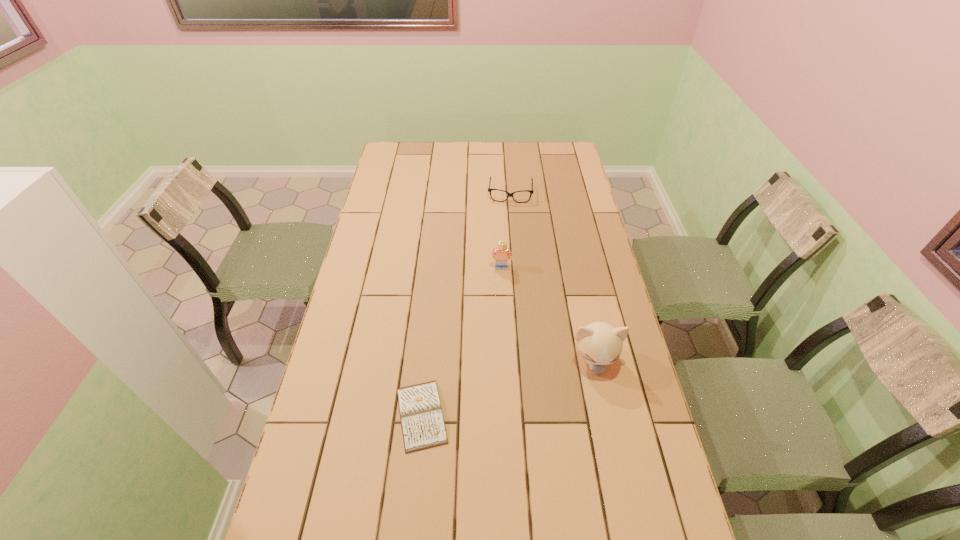
You are a GUI agent. You are given a task and a screenshot of the screen. Output one action in this format:
    pyautogui.click(x=<x>, y=<y>)
    Task: Click on the vacant spot on the desktop that is between the diary and the third farthest object and is positioned on the front-facing side of the second farthest object
    This screenshot has width=960, height=540.
    Given the screenshot: What is the action you would take?
    pyautogui.click(x=501, y=390)

Where is `vacant space on the desktop that is between the nearest object and the rightmost object and is positioned on the front-facing side of the third tallest object`? vacant space on the desktop that is between the nearest object and the rightmost object and is positioned on the front-facing side of the third tallest object is located at coordinates (500, 390).